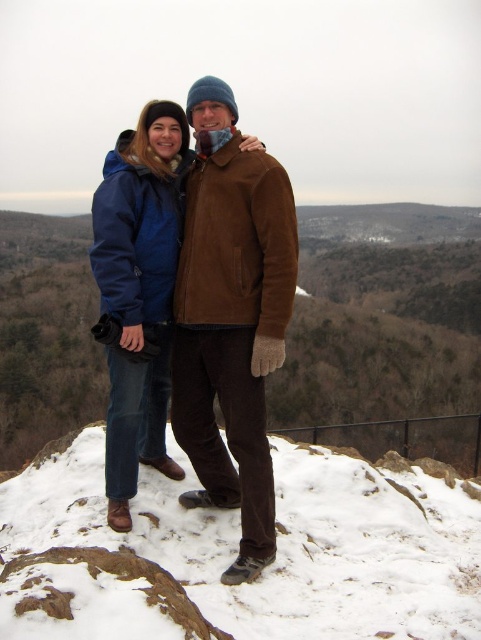
Is white powdery snow at center to the left of brown suede jacket at center from the viewer's perspective?

Incorrect, white powdery snow at center is not on the left side of brown suede jacket at center.

Is point (135, 500) positioned in front of point (231, 128)?

Yes, point (135, 500) is closer to viewer.

Who is more distant from viewer, (282, 616) or (245, 522)?

Positioned behind is point (245, 522).

This screenshot has height=640, width=481. Identify the location of white powdery snow at center. (236, 552).